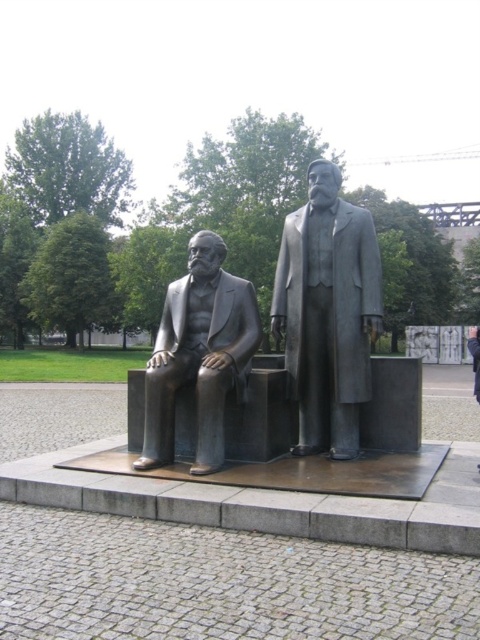
You are a maintenance worker in the park and need to locate the point at coordinates [327,312] on the bronze statue of two historical figures. According to the scene description, where exactly should you look on the statue?

The point at coordinates [327,312] is located on the polished bronze statue at center, so you should look at the central area of the statue where both figures are positioned.

You are a tour guide explaining the layout of the park. Where is the polished bronze statue at center situated in relation to the raised platform and the surrounding area?

The polished bronze statue at center is located at point coordinates (x=327, y=312) on the raised platform, which is bordered by a low curb in the park setting.